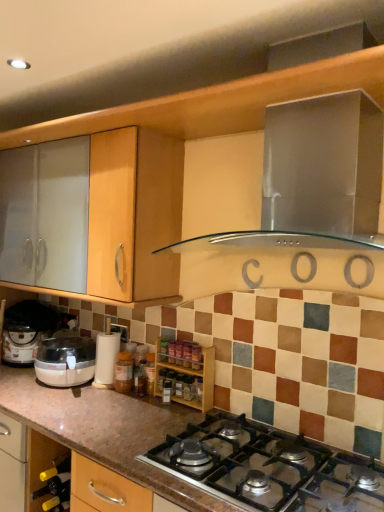
The width and height of the screenshot is (384, 512). Identify the location of white plastic coffee machine at lower left. (106, 357).

This screenshot has width=384, height=512. Describe the element at coordinates (106, 357) in the screenshot. I see `white plastic coffee machine at lower left` at that location.

The image size is (384, 512). Identify the location of translucent glass spice at center, arranged as the 2th bottle when viewed from the left. (161, 379).

The height and width of the screenshot is (512, 384). Identify the location of wooden spice rack at center. (186, 372).

Image resolution: width=384 pixels, height=512 pixels. What do you see at coordinates (323, 167) in the screenshot?
I see `stainless steel range hood at upper center` at bounding box center [323, 167].

In order to face stainless steel range hood at upper center, should I rotate leftwards or rightwards?

A 15.681 degree turn to the right will do.

At what (x,y) coordinates should I click in order to perform the action: click on green glass wine bottle at lower left. Please return your answer as a coordinate pair (x, y). The image size is (384, 512). Looking at the image, I should click on (54, 486).

At what (x,y) coordinates should I click in order to perform the action: click on translucent plastic bottle at center, which is the 2th bottle from right to left. Please return your answer as a coordinate pair (x, y). The height and width of the screenshot is (512, 384). Looking at the image, I should click on (123, 372).

At what (x,y) coordinates should I click in order to perform the action: click on white plastic coffee machine at lower left. Please return your answer as a coordinate pair (x, y). Image resolution: width=384 pixels, height=512 pixels. Looking at the image, I should click on (106, 357).

At what (x,y) coordinates should I click in order to perform the action: click on coffee machine below the stainless steel range hood at upper center (from a real-world perspective). Please return your answer as a coordinate pair (x, y). Looking at the image, I should click on (106, 357).

Do you think white plastic coffee machine at lower left is within stainless steel range hood at upper center, or outside of it?

white plastic coffee machine at lower left lies outside stainless steel range hood at upper center.

Would you say white plastic coffee machine at lower left is a long distance from stainless steel range hood at upper center?

Result: That's right, there is a large distance between white plastic coffee machine at lower left and stainless steel range hood at upper center.

Can you confirm if white plastic coffee machine at lower left is thinner than stainless steel range hood at upper center?

Indeed, white plastic coffee machine at lower left has a lesser width compared to stainless steel range hood at upper center.

Considering the sizes of objects translucent plastic bottle at center, the 1th bottle when ordered from back to front, and green glass wine bottle at lower left in the image provided, who is shorter, translucent plastic bottle at center, the 1th bottle when ordered from back to front, or green glass wine bottle at lower left?

Standing shorter between the two is green glass wine bottle at lower left.

How much distance is there between translucent plastic bottle at center, positioned as the 1th bottle in left-to-right order, and green glass wine bottle at lower left?

The distance of translucent plastic bottle at center, positioned as the 1th bottle in left-to-right order, from green glass wine bottle at lower left is 18.48 inches.

From the image's perspective, is translucent plastic bottle at center, the second bottle positioned from the front, located above or below green glass wine bottle at lower left?

Based on their image positions, translucent plastic bottle at center, the second bottle positioned from the front, is located above green glass wine bottle at lower left.

Considering the positions of objects translucent plastic bottle at center, the 1th bottle when ordered from back to front, and green glass wine bottle at lower left in the image provided, who is in front, translucent plastic bottle at center, the 1th bottle when ordered from back to front, or green glass wine bottle at lower left?

green glass wine bottle at lower left is more forward.

Which of these two, translucent glass spice at center, arranged as the 2th bottle when viewed from the left, or translucent plastic bottle at center, which is the 2th bottle from right to left, stands taller?

translucent plastic bottle at center, which is the 2th bottle from right to left.

Is translucent glass spice at center, which is the 1th bottle in right-to-left order, not near translucent plastic bottle at center, the 1th bottle when ordered from back to front?

No, translucent glass spice at center, which is the 1th bottle in right-to-left order, is in close proximity to translucent plastic bottle at center, the 1th bottle when ordered from back to front.

Which object is closer to the camera, translucent glass spice at center, which is the 1th bottle in front-to-back order, or translucent plastic bottle at center, the 1th bottle when ordered from back to front?

translucent glass spice at center, which is the 1th bottle in front-to-back order, is more forward.

Looking at their sizes, would you say translucent glass spice at center, which is the 1th bottle in front-to-back order, is wider or thinner than translucent plastic bottle at center, the second bottle positioned from the front?

Considering their sizes, translucent glass spice at center, which is the 1th bottle in front-to-back order, looks slimmer than translucent plastic bottle at center, the second bottle positioned from the front.

Considering the positions of points (197, 484) and (120, 380), is point (197, 484) closer to camera compared to point (120, 380)?

That is True.

From a real-world perspective, is metallic silver gas stove at center on top of translucent plastic bottle at center, the second bottle positioned from the front?

No, from a real-world perspective, metallic silver gas stove at center is not on top of translucent plastic bottle at center, the second bottle positioned from the front.

Locate an element on the screen. gas stove on the right of translucent plastic bottle at center, the 1th bottle when ordered from back to front is located at coordinates (268, 467).

Is metallic silver gas stove at center in front of or behind translucent plastic bottle at center, the 1th bottle when ordered from back to front, in the image?

metallic silver gas stove at center is in front of translucent plastic bottle at center, the 1th bottle when ordered from back to front.

From a real-world perspective, is metallic silver gas stove at center physically located above or below stainless steel range hood at upper center?

In terms of real-world spatial position, metallic silver gas stove at center is below stainless steel range hood at upper center.

Which of these two, metallic silver gas stove at center or stainless steel range hood at upper center, stands taller?

With more height is stainless steel range hood at upper center.

Which object is closer to the camera taking this photo, metallic silver gas stove at center or stainless steel range hood at upper center?

metallic silver gas stove at center is more forward.

Can you confirm if white plastic coffee machine at lower left is thinner than green glass wine bottle at lower left?

No.

Between point (109, 373) and point (64, 478), which one is positioned behind?

Positioned behind is point (109, 373).

Considering the positions of objects white plastic coffee machine at lower left and green glass wine bottle at lower left in the image provided, who is behind, white plastic coffee machine at lower left or green glass wine bottle at lower left?

white plastic coffee machine at lower left is further from the camera.

Does white plastic coffee machine at lower left contain green glass wine bottle at lower left?

No, green glass wine bottle at lower left is not surrounded by white plastic coffee machine at lower left.

From a real-world perspective, which is physically below, metallic silver gas stove at center or green glass wine bottle at lower left?

green glass wine bottle at lower left, from a real-world perspective.

From the image's perspective, which object appears higher, metallic silver gas stove at center or green glass wine bottle at lower left?

metallic silver gas stove at center appears higher in the image.

Which object is positioned more to the left, metallic silver gas stove at center or green glass wine bottle at lower left?

green glass wine bottle at lower left.

Is metallic silver gas stove at center thinner than green glass wine bottle at lower left?

No, metallic silver gas stove at center is not thinner than green glass wine bottle at lower left.

Find the location of `coffee machine behind the stainless steel range hood at upper center`. coffee machine behind the stainless steel range hood at upper center is located at coordinates (106, 357).

This screenshot has width=384, height=512. Identify the location of wine bottle directly beneath the translucent plastic bottle at center, the 1th bottle when ordered from back to front (from a real-world perspective). (54, 486).

Looking at this image, based on their spatial positions, is translucent glass spice at center, the 2th bottle viewed from the back, or metallic silver gas stove at center further from translucent plastic bottle at center, which is the 2th bottle from right to left?

metallic silver gas stove at center lies further to translucent plastic bottle at center, which is the 2th bottle from right to left, than the other object.

Which object lies further to the anchor point white plastic coffee machine at lower left, green glass wine bottle at lower left or wooden spice rack at center?

green glass wine bottle at lower left.

Considering their positions, is translucent glass spice at center, the 2th bottle viewed from the back, positioned further to green glass wine bottle at lower left than translucent plastic bottle at center, positioned as the 1th bottle in left-to-right order?

translucent glass spice at center, the 2th bottle viewed from the back, is further to green glass wine bottle at lower left.

Consider the image. Which object lies further to the anchor point translucent glass spice at center, arranged as the 2th bottle when viewed from the left, white plastic coffee machine at lower left or metallic silver gas stove at center?

metallic silver gas stove at center is positioned further to the anchor translucent glass spice at center, arranged as the 2th bottle when viewed from the left.

Estimate the real-world distances between objects in this image. Which object is closer to translucent glass spice at center, which is the 1th bottle in right-to-left order, stainless steel range hood at upper center or translucent plastic bottle at center, positioned as the 1th bottle in left-to-right order?

The object closer to translucent glass spice at center, which is the 1th bottle in right-to-left order, is translucent plastic bottle at center, positioned as the 1th bottle in left-to-right order.

Estimate the real-world distances between objects in this image. Which object is further from translucent glass spice at center, the 2th bottle viewed from the back, stainless steel range hood at upper center or wooden spice rack at center?

Based on the image, stainless steel range hood at upper center appears to be further to translucent glass spice at center, the 2th bottle viewed from the back.

From the image, which object appears to be nearer to metallic silver gas stove at center, translucent plastic bottle at center, which is the 2th bottle from right to left, or white plastic coffee machine at lower left?

Based on the image, translucent plastic bottle at center, which is the 2th bottle from right to left, appears to be nearer to metallic silver gas stove at center.

Estimate the real-world distances between objects in this image. Which object is further from translucent glass spice at center, arranged as the 2th bottle when viewed from the left, metallic silver gas stove at center or translucent plastic bottle at center, which is the 2th bottle from right to left?

metallic silver gas stove at center is further to translucent glass spice at center, arranged as the 2th bottle when viewed from the left.

The height and width of the screenshot is (512, 384). In order to click on bottle between stainless steel range hood at upper center and translucent glass spice at center, the 2th bottle viewed from the back, from top to bottom in this screenshot , I will do `click(123, 372)`.

The image size is (384, 512). Find the location of `coffee machine between stainless steel range hood at upper center and green glass wine bottle at lower left from top to bottom`. coffee machine between stainless steel range hood at upper center and green glass wine bottle at lower left from top to bottom is located at coordinates (106, 357).

Locate an element on the screen. The width and height of the screenshot is (384, 512). bottle between translucent plastic bottle at center, which is the 2th bottle from right to left, and green glass wine bottle at lower left vertically is located at coordinates (161, 379).

Where is `cabinetry between metallic silver gas stove at center and translucent glass spice at center, which is the 1th bottle in right-to-left order, along the z-axis`? The width and height of the screenshot is (384, 512). cabinetry between metallic silver gas stove at center and translucent glass spice at center, which is the 1th bottle in right-to-left order, along the z-axis is located at coordinates coord(186,372).